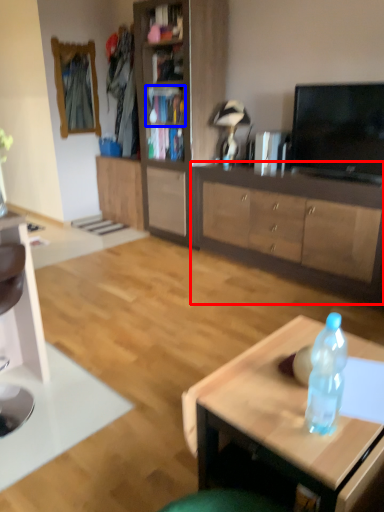
Question: Which of the following is the closest to the observer, cabinetry (highlighted by a red box) or cabinet (highlighted by a blue box)?

Choices:
 (A) cabinetry
 (B) cabinet

Answer: (A)